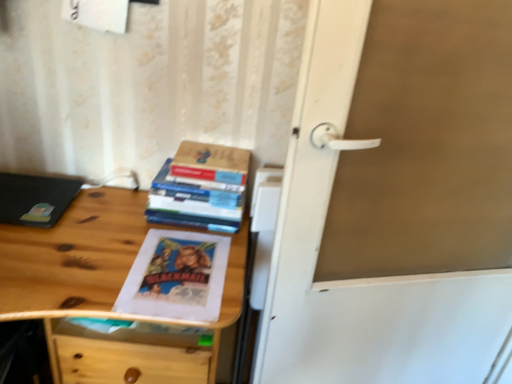
Find the location of `vacant point above matte black laptop at left (from a real-world perspective)`. vacant point above matte black laptop at left (from a real-world perspective) is located at coordinates (31, 192).